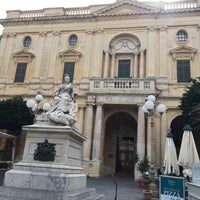
This screenshot has width=200, height=200. I want to click on doors, so click(122, 161), click(131, 163).